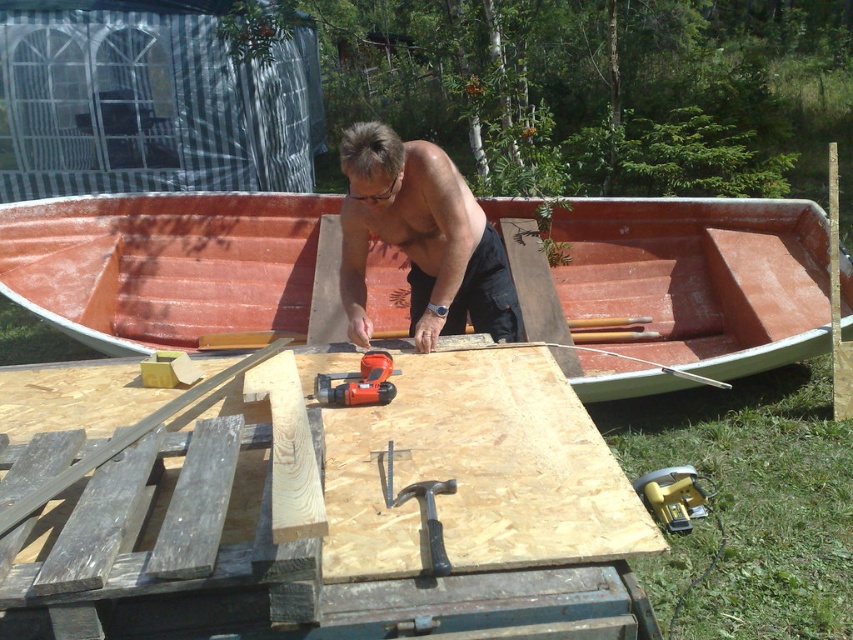
Looking at this image, you are helping the man with his woodworking project. He asks you to place the orange painted wood canoe at center and the shiny orange boat at center on the plywood workspace. Which object should be placed first to ensure they both fit properly?

The orange painted wood canoe at center is larger in size than the shiny orange boat at center, so you should place the orange painted wood canoe at center first to ensure there is enough space for both.